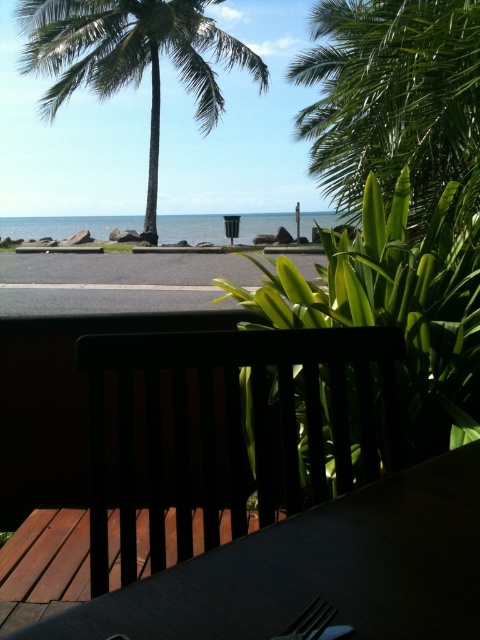
Can you confirm if green leafy palm tree at upper right is bigger than metallic silverware at lower center?

Yes, green leafy palm tree at upper right is bigger than metallic silverware at lower center.

Which of these two, green leafy palm tree at upper right or metallic silverware at lower center, stands taller?

Standing taller between the two is green leafy palm tree at upper right.

The width and height of the screenshot is (480, 640). Identify the location of green leafy palm tree at upper right. (394, 100).

Can you confirm if green leafy palm tree at upper left is wider than metallic silverware at lower center?

Yes, green leafy palm tree at upper left is wider than metallic silverware at lower center.

Between point (43, 8) and point (325, 609), which one is positioned in front?

Point (325, 609)

The height and width of the screenshot is (640, 480). What are the coordinates of `green leafy palm tree at upper left` in the screenshot? It's located at (132, 58).

Between point (360, 554) and point (301, 611), which one is positioned behind?

The point (360, 554) is behind.

Can you confirm if dark wood table at center is positioned above metallic silverware at lower center?

Indeed, dark wood table at center is positioned over metallic silverware at lower center.

Locate an element on the screen. dark wood table at center is located at coordinates (319, 570).

Locate an element on the screen. The image size is (480, 640). dark wood table at center is located at coordinates (319, 570).